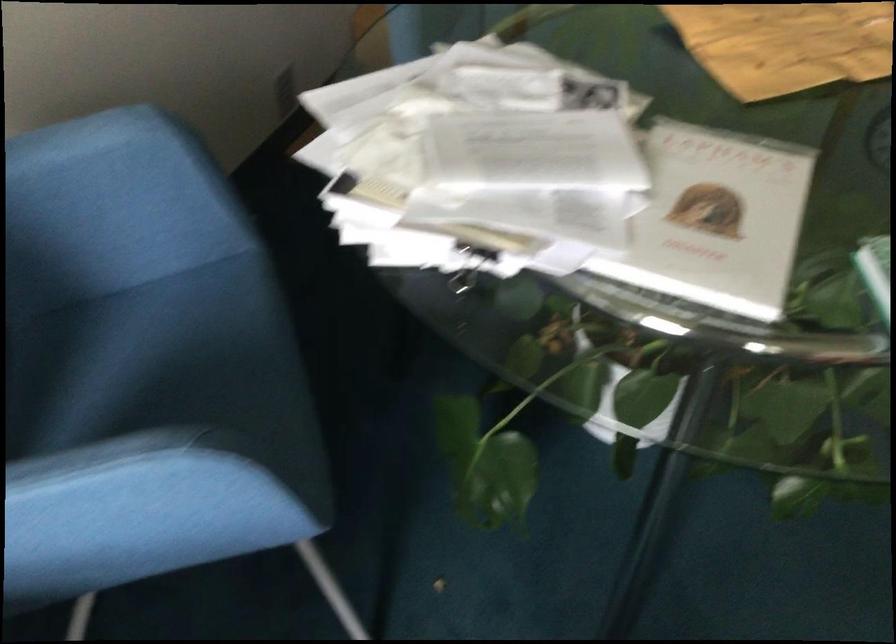
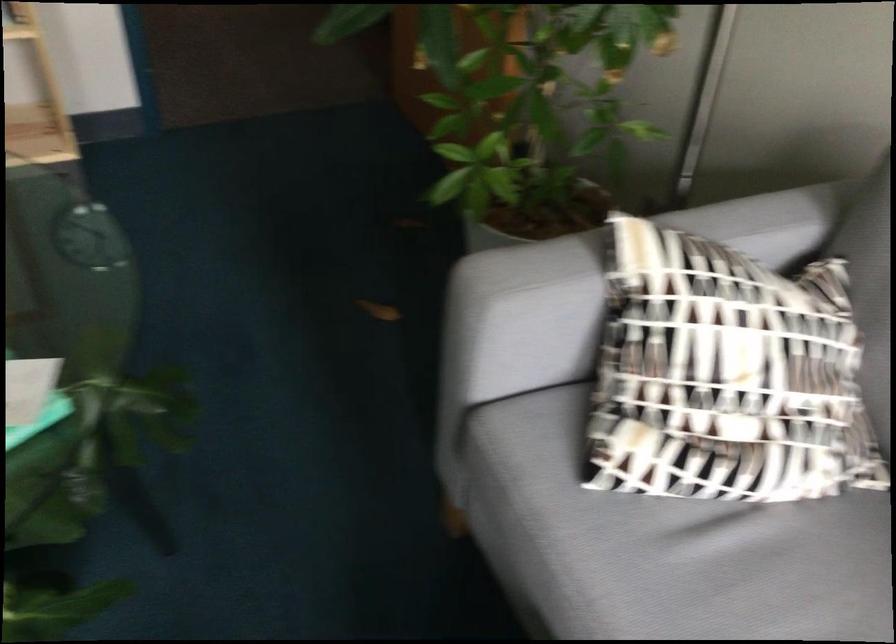
Question: The camera is either moving clockwise (left) or counter-clockwise (right) around the object. The first image is from the beginning of the video and the second image is from the end. Is the camera moving left or right when shooting the video?

Choices:
 (A) Left
 (B) Right

Answer: (A)